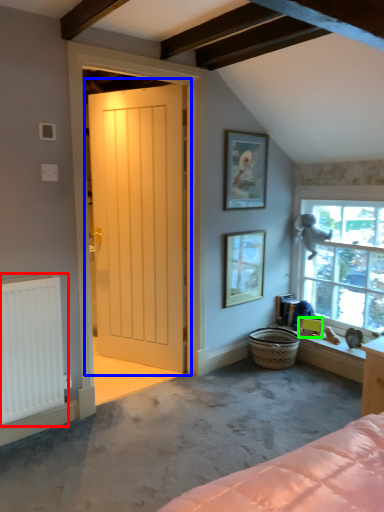
Question: Which object is the farthest from radiator (highlighted by a red box)? Choose among these: door (highlighted by a blue box) or picture frame (highlighted by a green box).

Choices:
 (A) door
 (B) picture frame

Answer: (B)